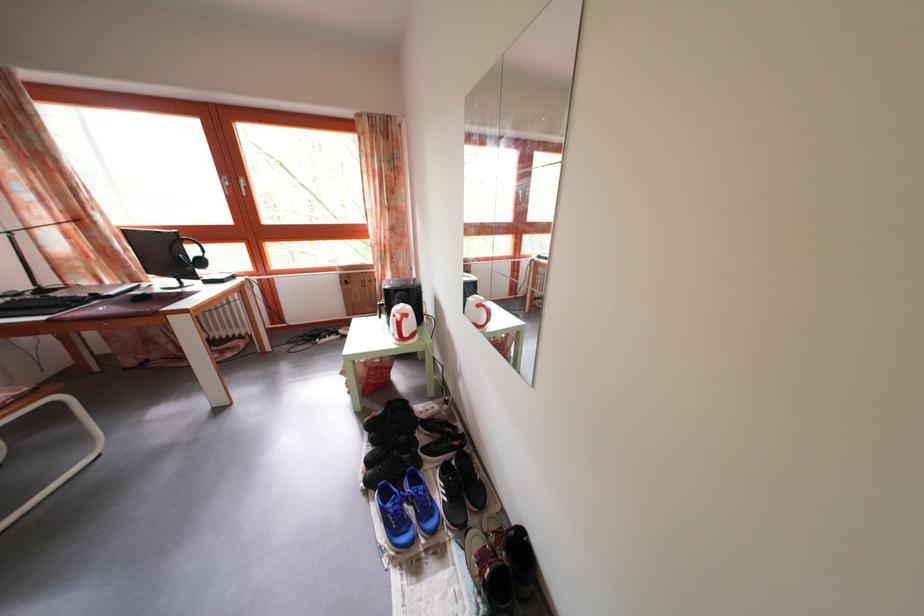
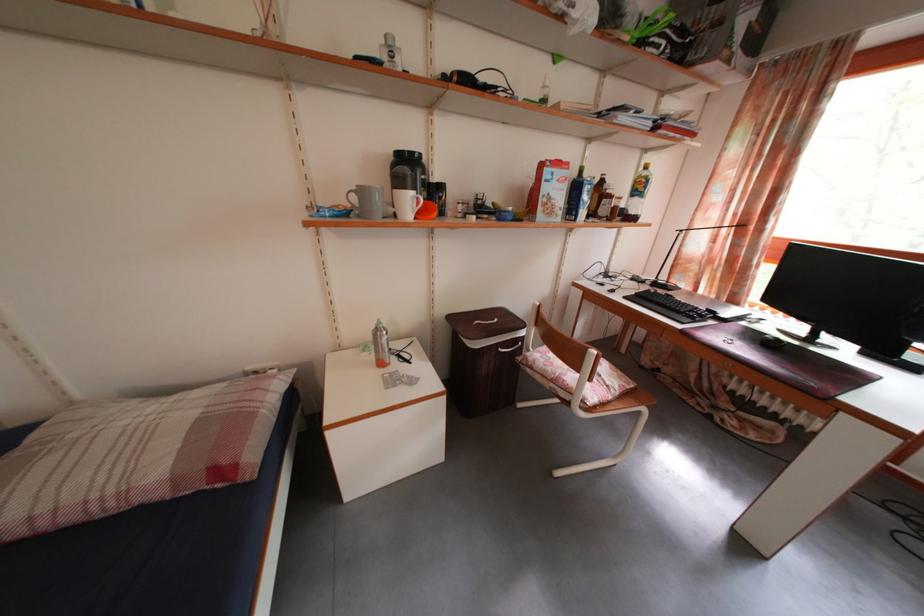
Where in the second image is the point corresponding to point (56, 290) from the first image?

(671, 285)